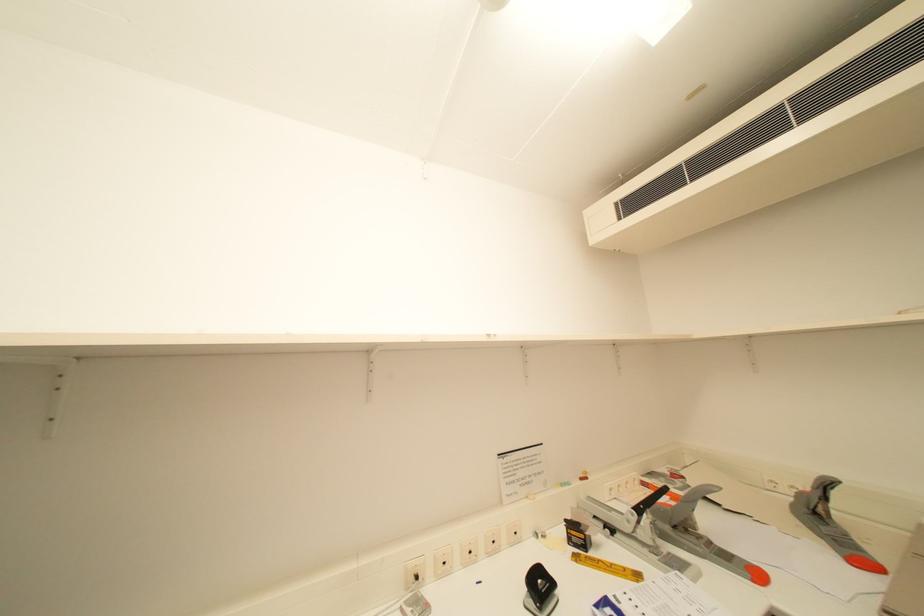
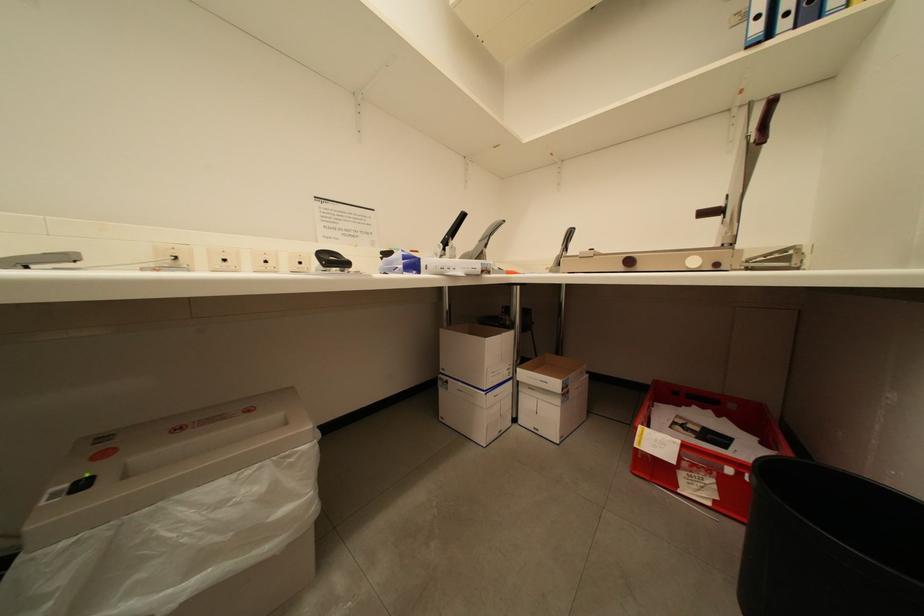
The images are taken continuously from a first-person perspective. In which direction is your viewpoint rotating?

The camera rotated toward right-down.